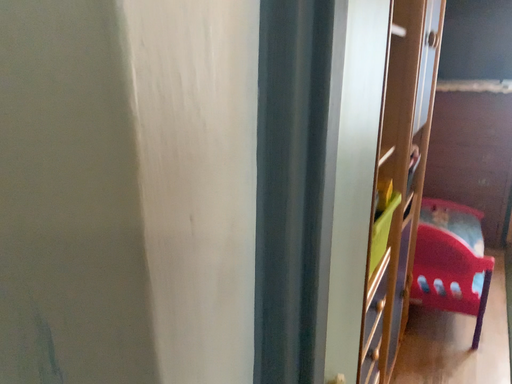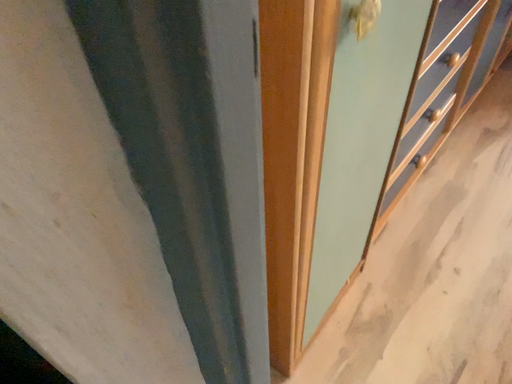
Question: Which way did the camera rotate in the video?

Choices:
 (A) rotated downward
 (B) rotated upward

Answer: (A)